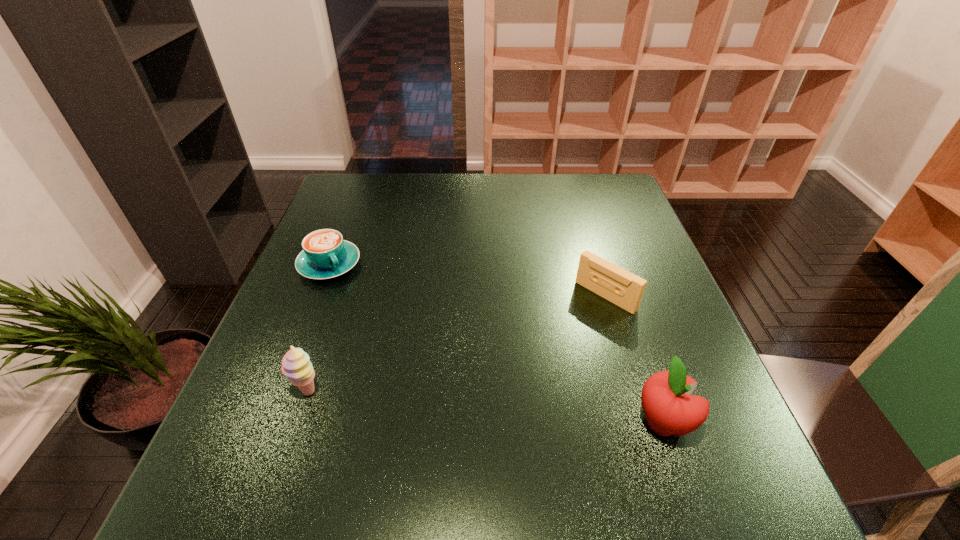
The width and height of the screenshot is (960, 540). In order to click on free spot between the videotape and the apple in this screenshot , I will do `click(635, 359)`.

Image resolution: width=960 pixels, height=540 pixels. Find the location of `vacant area between the third tallest object and the apple`. vacant area between the third tallest object and the apple is located at coordinates (635, 359).

Identify the location of vacant area that lies between the cappuccino and the sherbert. (319, 328).

Where is `free space between the third tallest object and the apple`? free space between the third tallest object and the apple is located at coordinates (635, 359).

Point out which object is positioned as the second nearest to the sherbert. Please provide its 2D coordinates. Your answer should be formatted as a tuple, i.e. [(x, y)], where the tuple contains the x and y coordinates of a point satisfying the conditions above.

[(619, 286)]

This screenshot has height=540, width=960. I want to click on object that is the nearest to the sherbert, so click(x=325, y=255).

Find the location of a particular element. This screenshot has height=540, width=960. free spot that satisfies the following two spatial constraints: 1. on the front side of the apple; 2. on the side where a bite is taken out of the shortest object is located at coordinates (268, 422).

The height and width of the screenshot is (540, 960). Identify the location of free point that satisfies the following two spatial constraints: 1. on the front side of the videotape; 2. on the side where a bite is taken out of the apple. (643, 422).

At what (x,y) coordinates should I click in order to perform the action: click on vacant area in the image that satisfies the following two spatial constraints: 1. on the front side of the third tallest object; 2. on the side where a bite is taken out of the apple. Please return your answer as a coordinate pair (x, y). The image size is (960, 540). Looking at the image, I should click on (643, 422).

This screenshot has width=960, height=540. Find the location of `vacant space that satisfies the following two spatial constraints: 1. on the front side of the cappuccino; 2. on the right side of the third tallest object`. vacant space that satisfies the following two spatial constraints: 1. on the front side of the cappuccino; 2. on the right side of the third tallest object is located at coordinates (317, 296).